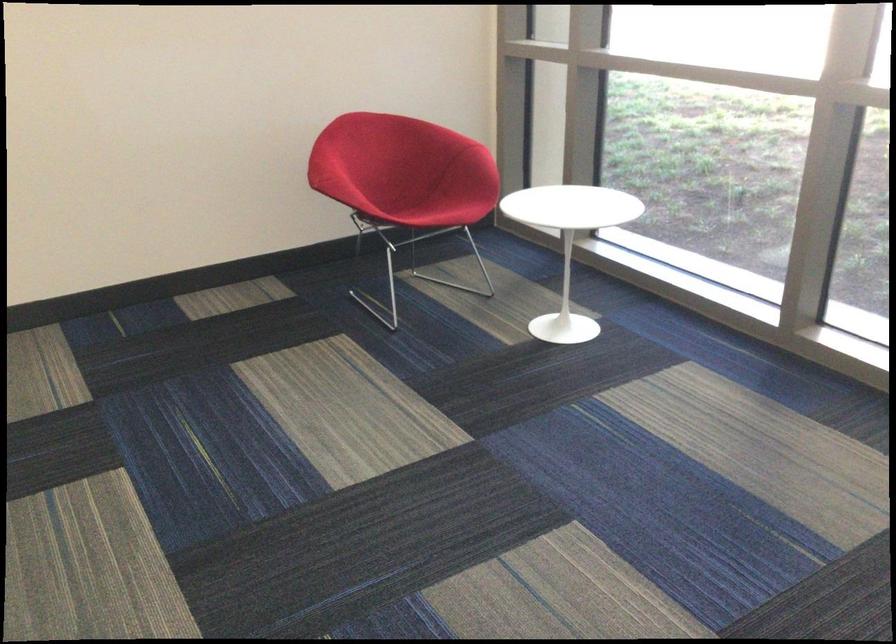
Locate an element on the screen. The image size is (896, 644). red chair sitting surface is located at coordinates (403, 194).